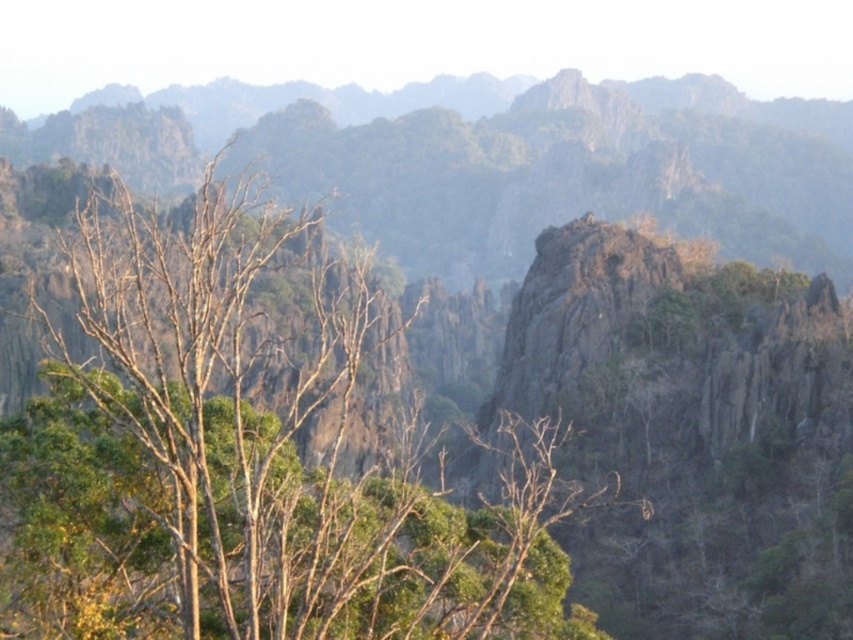
You are planning to set up a tent for camping in this mountainous area. You have two options for the location near the green leafy tree at center and the rugged gray rock at center. Considering the height of the objects, which location would provide better protection from falling debris from above?

The rugged gray rock at center is taller than the green leafy tree at center. Therefore, setting up the tent near the rugged gray rock at center would provide better protection from falling debris as it can act as a shield against objects falling from above.

You are a hiker planning to set up a tent in this mountainous area. You have two options for the location of your tent site. One is near the green leafy tree at center, and the other is near the rough gray rock at center. Considering the size difference between these two objects, which location would provide more shade during the afternoon? Please explain your reasoning based on the objects described.

The green leafy tree at center is larger than the rough gray rock at center. Therefore, the green leafy tree at center would provide more shade during the afternoon because larger trees typically cast bigger shadows compared to smaller rocks.

You are standing at the point marked at coordinates (253,451) in the rugged mountainous landscape. Which object are you standing on?

You are standing on the green leafy tree at center, as the point marked at coordinates (253,451) is located on it.